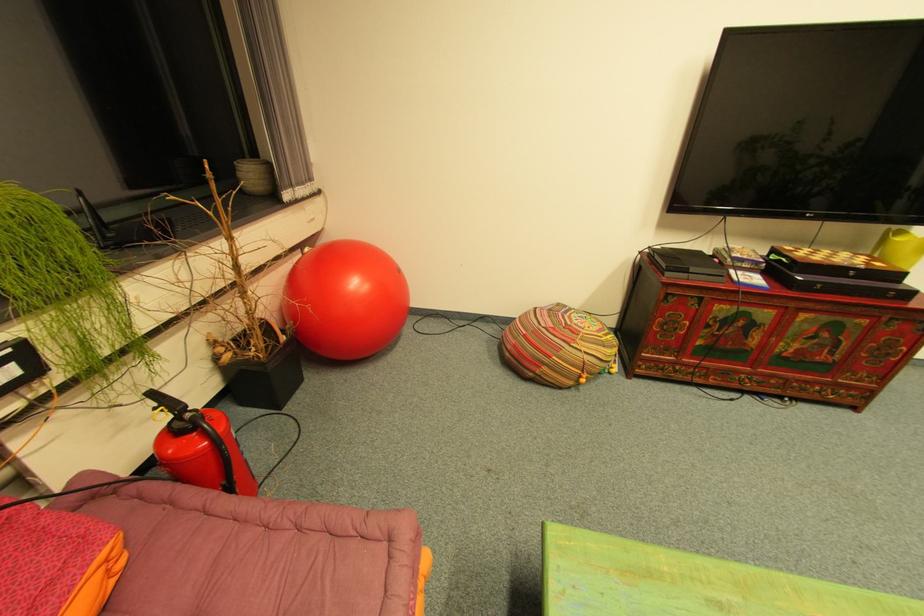
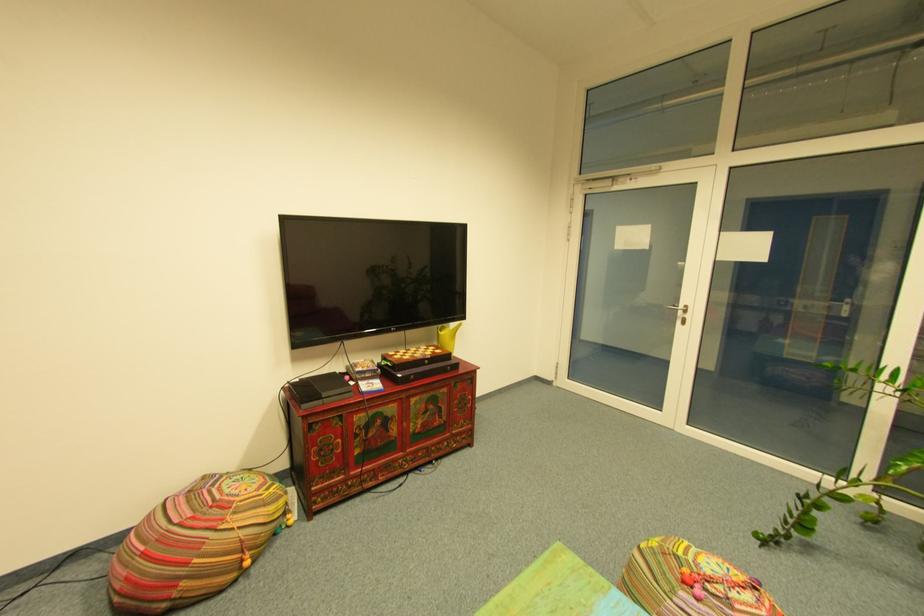
Question: The images are taken continuously from a first-person perspective. In which direction is your viewpoint rotating?

Choices:
 (A) Left
 (B) Right
 (C) Up
 (D) Down

Answer: (B)